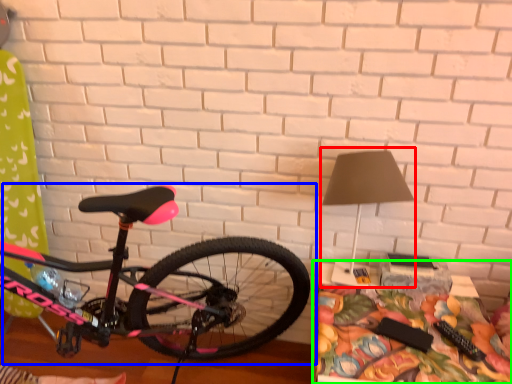
Question: Based on their relative distances, which object is farther from table lamp (highlighted by a red box)? Choose from bicycle (highlighted by a blue box) and table (highlighted by a green box).

Choices:
 (A) bicycle
 (B) table

Answer: (A)